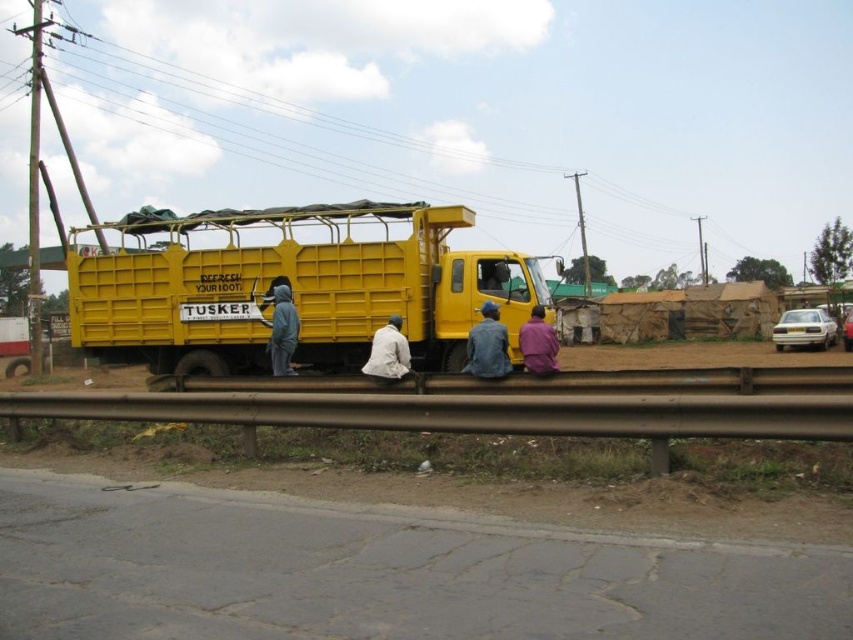
Question: Can you confirm if yellow matte truck at center is bigger than gray hoodie at left?

Choices:
 (A) no
 (B) yes

Answer: (B)

Question: Which point is farther from the camera taking this photo?

Choices:
 (A) (289, 326)
 (B) (375, 340)
 (C) (538, 352)

Answer: (A)

Question: Which is nearer to the denim jacket at center?

Choices:
 (A) purple fabric shirt at lower center
 (B) white matte jacket at center
 (C) yellow matte truck at center
 (D) gray hoodie at left

Answer: (A)

Question: Can you confirm if gray hoodie at left is positioned below purple fabric shirt at lower center?

Choices:
 (A) yes
 (B) no

Answer: (B)

Question: Which point appears farthest from the camera in this image?

Choices:
 (A) (525, 332)
 (B) (80, 332)
 (C) (494, 317)
 (D) (368, 369)

Answer: (B)

Question: Can you confirm if gray hoodie at left is bigger than purple fabric shirt at lower center?

Choices:
 (A) no
 (B) yes

Answer: (A)